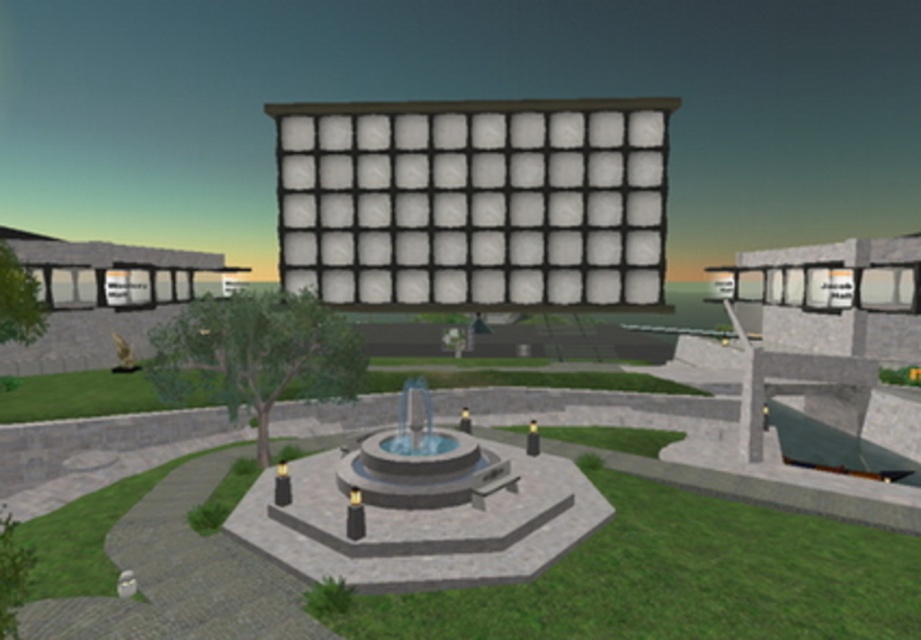
You are a drone operator flying a drone that requires a minimum of 5 feet of clearance to avoid collision. You notice two fountains in the scene, the smooth gray fountain at center and the clear glass fountain at center. Can you safely navigate between them without hitting either?

The smooth gray fountain at center is 7.41 feet from the clear glass fountain at center, which is greater than the required 5 feet clearance. Therefore, the drone can safely navigate between them without collision.